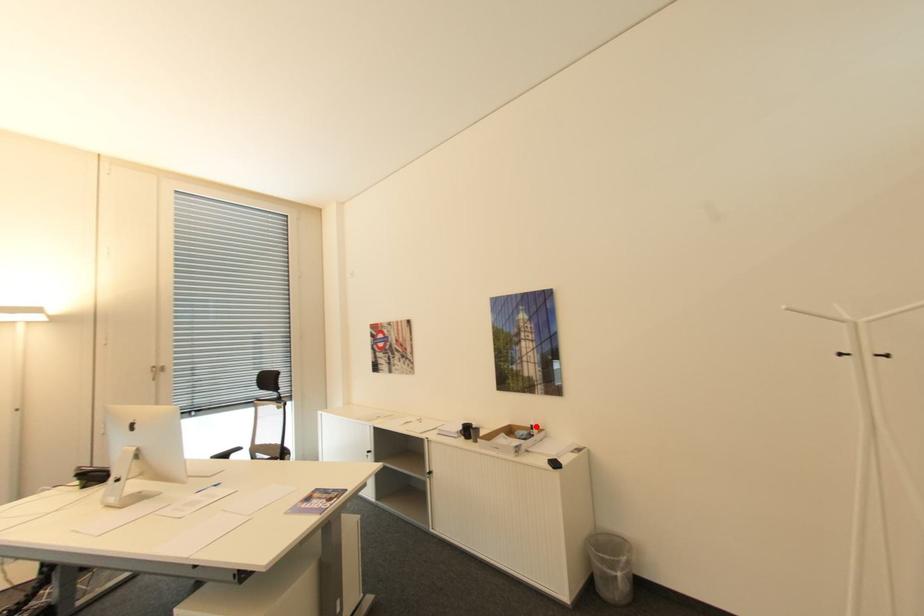
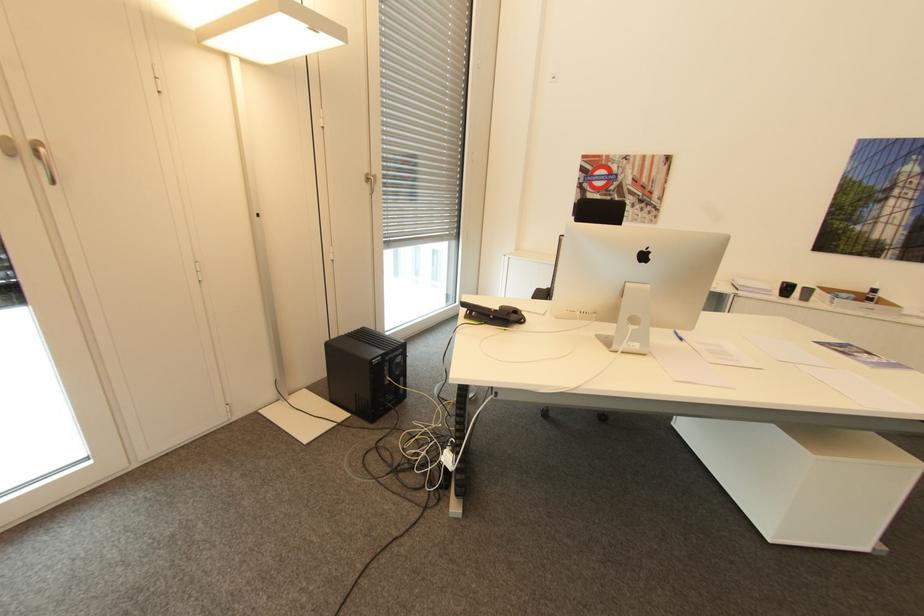
Question: I am providing you with two images of the same scene from different viewpoints. Given a red point in image1, look at the same physical point in image2. Is it:

Choices:
 (A) Closer to the viewpoint
 (B) Farther from the viewpoint

Answer: (A)